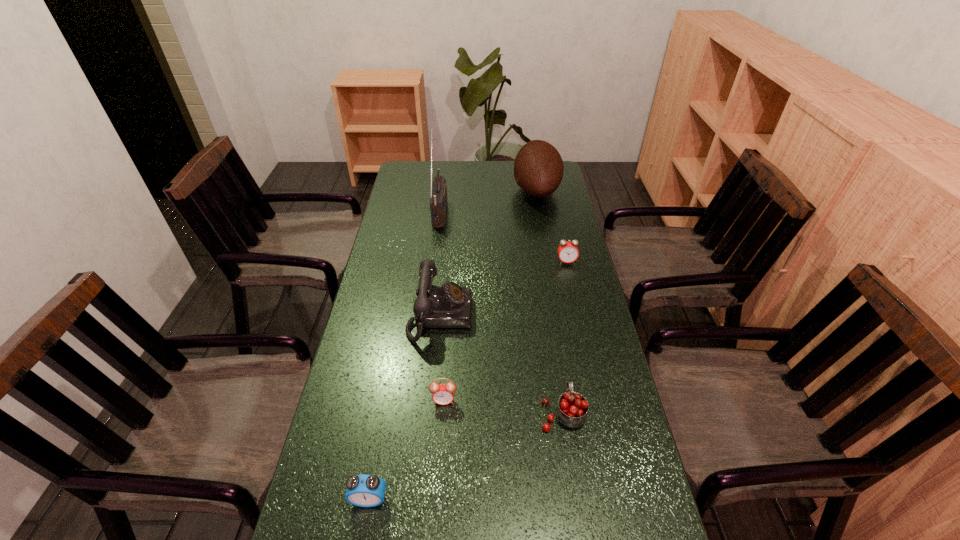
Where is `vacant space that is in between the nearest alarm clock and the fourth tallest object`? The width and height of the screenshot is (960, 540). vacant space that is in between the nearest alarm clock and the fourth tallest object is located at coordinates (466, 456).

At what (x,y) coordinates should I click in order to perform the action: click on vacant area that lies between the nearest alarm clock and the second tallest object. Please return your answer as a coordinate pair (x, y). This screenshot has width=960, height=540. Looking at the image, I should click on (453, 345).

Identify the location of vacant space that is in between the farthest alarm clock and the radio receiver. The image size is (960, 540). (503, 237).

Identify the location of empty space between the third farthest object and the tallest object. (503, 237).

Where is `free space that is in between the nearest object and the tallest object`? free space that is in between the nearest object and the tallest object is located at coordinates (405, 355).

The image size is (960, 540). Find the location of `vacant area between the tallest object and the nearest object`. vacant area between the tallest object and the nearest object is located at coordinates (405, 355).

Where is `object that can be found as the closest to the radio receiver`? object that can be found as the closest to the radio receiver is located at coordinates (538, 168).

I want to click on object that is the fourth closest to the rightmost alarm clock, so click(x=572, y=408).

Locate an element on the screen. This screenshot has height=540, width=960. alarm clock that can be found as the second closest to the radio receiver is located at coordinates (443, 394).

Locate an element on the screen. The image size is (960, 540). alarm clock that is the third closest to the telephone is located at coordinates (364, 490).